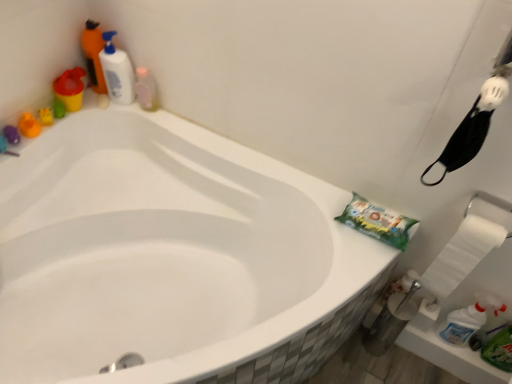
Question: From the image's perspective, is green paper towel at upper right above or below translucent plastic bottle at upper left, which is counted as the first cleaning product, starting from the left?

Choices:
 (A) below
 (B) above

Answer: (A)

Question: Would you say green paper towel at upper right is inside or outside translucent plastic bottle at upper left, acting as the 3th cleaning product starting from the right?

Choices:
 (A) outside
 (B) inside

Answer: (A)

Question: Based on their relative distances, which object is farther from the translucent plastic bottle at upper left, acting as the 3th cleaning product starting from the right?

Choices:
 (A) white paper towel at right
 (B) white glossy bottle at upper left, the second cleaning product positioned from the right
 (C) green paper towel at upper right
 (D) translucent plastic bottle at upper left, acting as the third cleaning product starting from the left

Answer: (A)

Question: Which object is the closest to the green paper towel at upper right?

Choices:
 (A) translucent plastic bottle at upper left, acting as the third cleaning product starting from the left
 (B) white glossy bottle at upper left, acting as the second cleaning product starting from the left
 (C) white paper towel at right
 (D) translucent plastic bottle at upper left, which is counted as the first cleaning product, starting from the left

Answer: (C)